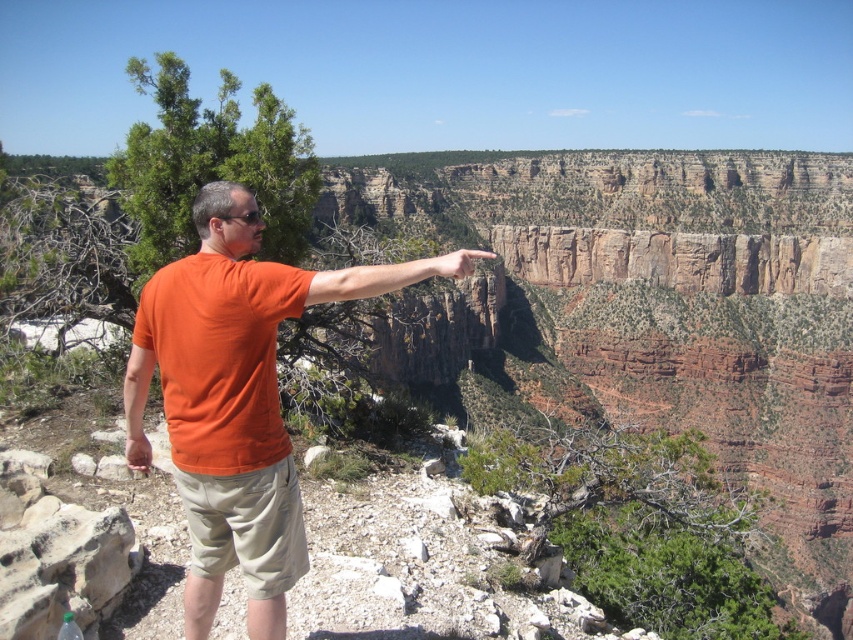
Locate an element on the screen. orange cotton shirt at center is located at coordinates (231, 401).

Does orange cotton shirt at center have a greater height compared to matte skin hand at upper center?

Correct, orange cotton shirt at center is much taller as matte skin hand at upper center.

What do you see at coordinates (231, 401) in the screenshot?
I see `orange cotton shirt at center` at bounding box center [231, 401].

Find the location of a particular element. Image resolution: width=853 pixels, height=640 pixels. orange cotton shirt at center is located at coordinates (231, 401).